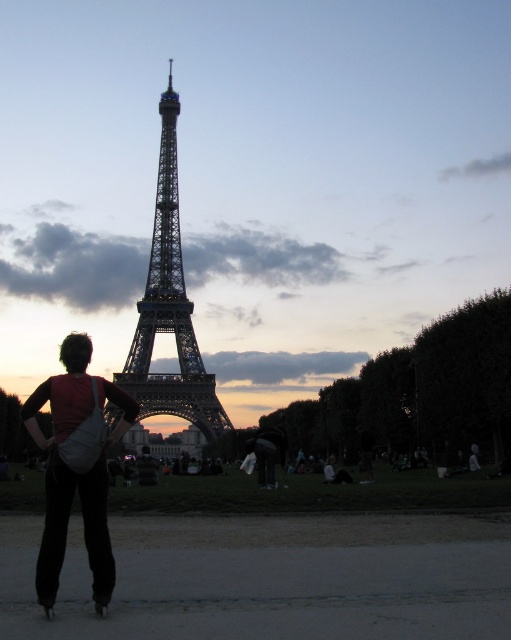
Which is above, matte white bag at lower left or metallic structure at center?

metallic structure at center

Between matte white bag at lower left and metallic structure at center, which one has less height?

matte white bag at lower left

Between point (84, 529) and point (174, 172), which one is positioned behind?

The point (174, 172) is more distant.

You are a GUI agent. You are given a task and a screenshot of the screen. Output one action in this format:
    pyautogui.click(x=<x>, y=<y>)
    Task: Click on the matte white bag at lower left
    The image size is (511, 640).
    Given the screenshot: What is the action you would take?
    pyautogui.click(x=76, y=470)